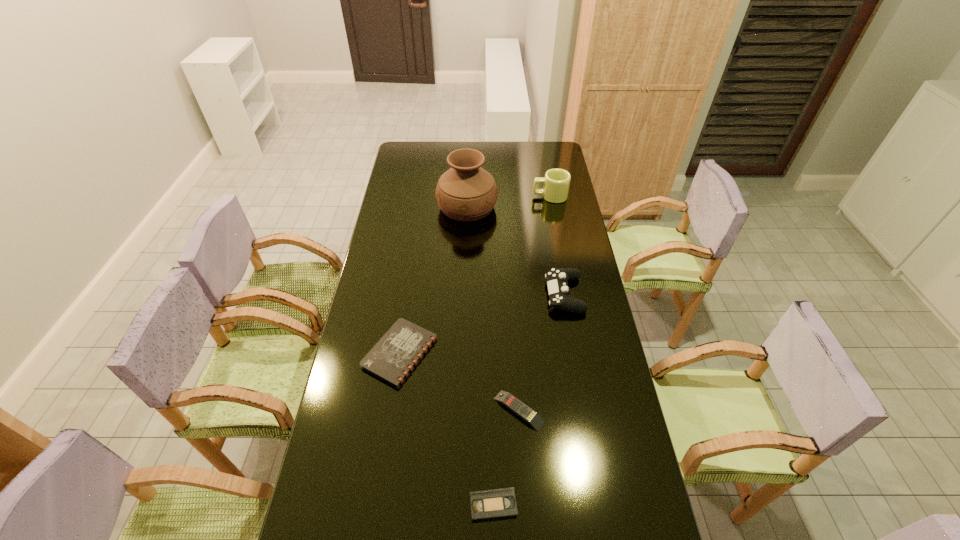
Identify the location of vacant space located 0.120m with the handle on the side of the mug. (507, 197).

Image resolution: width=960 pixels, height=540 pixels. I want to click on free space located 0.250m with the handle on the side of the mug, so click(479, 197).

Where is `free location located on the surface of the fourth shortest object`? This screenshot has height=540, width=960. free location located on the surface of the fourth shortest object is located at coordinates (525, 294).

Identify the location of vacant position located 0.110m on the surface of the fourth shortest object. (516, 294).

Find the location of `vacant position located on the surface of the fourth shortest object`. vacant position located on the surface of the fourth shortest object is located at coordinates tap(495, 294).

This screenshot has height=540, width=960. What are the coordinates of `blank space located 0.380m on the back of the notebook` in the screenshot? It's located at (416, 249).

I want to click on vacant region located on the right of the second nearest object, so tap(590, 410).

The width and height of the screenshot is (960, 540). Find the location of `vacant space located on the right of the shortest object`. vacant space located on the right of the shortest object is located at coordinates (560, 505).

The width and height of the screenshot is (960, 540). In order to click on object that is at the left edge in this screenshot , I will do coord(394,356).

Where is `mug that is at the right edge`? mug that is at the right edge is located at coordinates (556, 181).